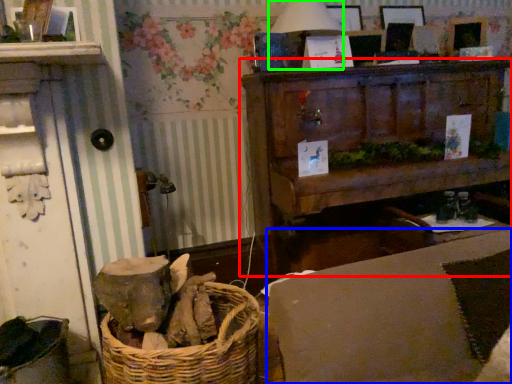
Question: Considering the real-world distances, which object is farthest from furniture (highlighted by a red box)? couch (highlighted by a blue box) or table lamp (highlighted by a green box)?

Choices:
 (A) couch
 (B) table lamp

Answer: (A)